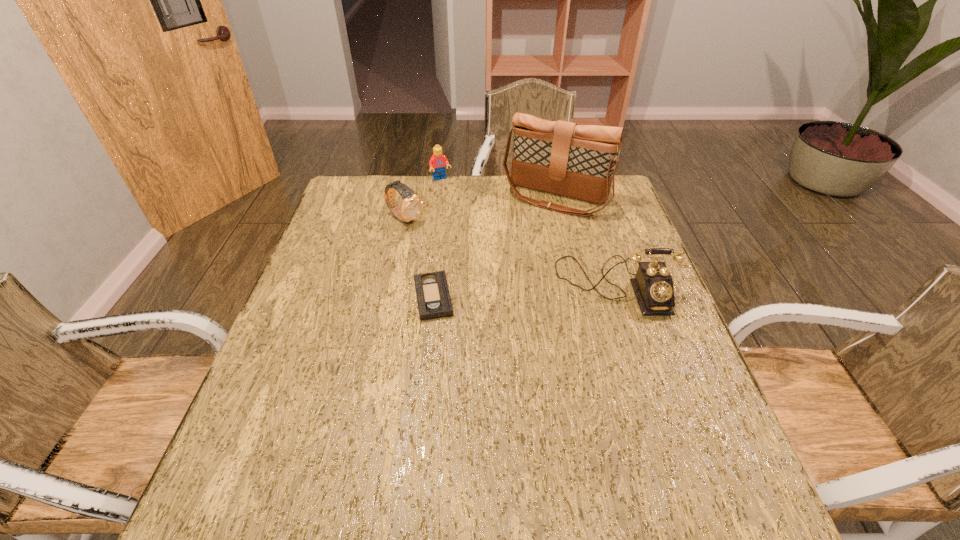
You are a GUI agent. You are given a task and a screenshot of the screen. Output one action in this format:
    pyautogui.click(x=<x>, y=<y>)
    Task: Click on the videotape
    The height and width of the screenshot is (540, 960).
    Given the screenshot: What is the action you would take?
    pyautogui.click(x=433, y=298)

Locate an element on the screen. The image size is (960, 540). telephone is located at coordinates (653, 285).

I want to click on watch, so click(412, 205).

Where is `Lego`? Lego is located at coordinates (438, 161).

Find the location of a particular element. The height and width of the screenshot is (540, 960). the tallest object is located at coordinates (578, 161).

Locate an element on the screen. This screenshot has width=960, height=540. vacant space located on the back of the shortest object is located at coordinates (444, 195).

You are a GUI agent. You are given a task and a screenshot of the screen. Output one action in this format:
    pyautogui.click(x=<x>, y=<y>)
    Task: Click on the free spot located on the dial of the telephone
    This screenshot has height=540, width=960.
    Given the screenshot: What is the action you would take?
    pyautogui.click(x=643, y=375)

The image size is (960, 540). What are the coordinates of `vacant space located 0.360m on the face of the watch` in the screenshot? It's located at (511, 284).

You are a GUI agent. You are given a task and a screenshot of the screen. Output one action in this format:
    pyautogui.click(x=<x>, y=<y>)
    Task: Click on the vacant space located 0.170m on the face of the watch
    The width and height of the screenshot is (960, 540).
    Given the screenshot: What is the action you would take?
    pyautogui.click(x=458, y=252)

The height and width of the screenshot is (540, 960). I want to click on vacant space located on the face of the watch, so coord(485,268).